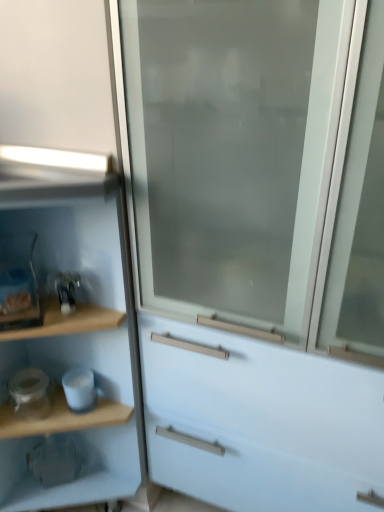
Question: From the image's perspective, is white glossy jar at lower left, which is counted as the 2th appliance, starting from the right, located beneath wooden shelf at left?

Choices:
 (A) yes
 (B) no

Answer: (A)

Question: From a real-world perspective, is white glossy jar at lower left, which is counted as the 2th appliance, starting from the right, under wooden shelf at left?

Choices:
 (A) no
 (B) yes

Answer: (B)

Question: Is white glossy jar at lower left, which is counted as the first appliance, starting from the left, not near wooden shelf at left?

Choices:
 (A) yes
 (B) no

Answer: (B)

Question: Considering the relative sizes of white glossy jar at lower left, which is counted as the first appliance, starting from the left, and wooden shelf at left in the image provided, is white glossy jar at lower left, which is counted as the first appliance, starting from the left, bigger than wooden shelf at left?

Choices:
 (A) yes
 (B) no

Answer: (B)

Question: Considering the relative sizes of white glossy jar at lower left, which is counted as the 2th appliance, starting from the right, and wooden shelf at left in the image provided, is white glossy jar at lower left, which is counted as the 2th appliance, starting from the right, shorter than wooden shelf at left?

Choices:
 (A) yes
 (B) no

Answer: (A)

Question: Would you say white glossy mug at lower left, which is the first appliance in right-to-left order, is inside or outside wooden shelf at left?

Choices:
 (A) inside
 (B) outside

Answer: (A)

Question: Is point (82, 374) positioned closer to the camera than point (34, 339)?

Choices:
 (A) closer
 (B) farther

Answer: (A)

Question: Based on their positions, is white glossy mug at lower left, which is the first appliance in right-to-left order, located to the left or right of wooden shelf at left?

Choices:
 (A) left
 (B) right

Answer: (B)

Question: From a real-world perspective, is white glossy mug at lower left, which is the first appliance in right-to-left order, positioned above or below wooden shelf at left?

Choices:
 (A) below
 (B) above

Answer: (A)

Question: From a real-world perspective, is frosted glass screen door at center positioned above or below white glossy mug at lower left, which appears as the second appliance when viewed from the left?

Choices:
 (A) above
 (B) below

Answer: (A)

Question: Based on their positions, is frosted glass screen door at center located to the left or right of white glossy mug at lower left, which is the first appliance in right-to-left order?

Choices:
 (A) right
 (B) left

Answer: (A)

Question: Is frosted glass screen door at center in front of or behind white glossy mug at lower left, which appears as the second appliance when viewed from the left, in the image?

Choices:
 (A) front
 (B) behind

Answer: (A)

Question: In terms of size, does frosted glass screen door at center appear bigger or smaller than white glossy mug at lower left, which is the first appliance in right-to-left order?

Choices:
 (A) small
 (B) big

Answer: (B)

Question: Considering the positions of wooden shelf at left and frosted glass screen door at center in the image, is wooden shelf at left wider or thinner than frosted glass screen door at center?

Choices:
 (A) thin
 (B) wide

Answer: (A)

Question: Is wooden shelf at left inside the boundaries of frosted glass screen door at center, or outside?

Choices:
 (A) inside
 (B) outside

Answer: (B)